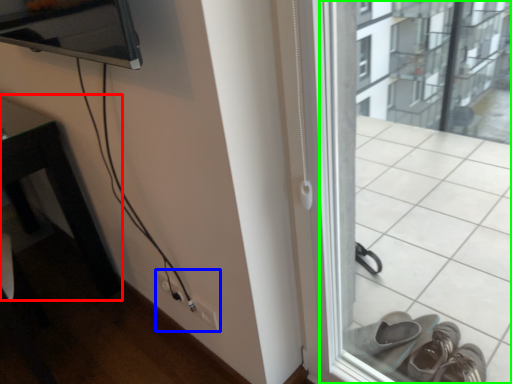
Question: Estimate the real-world distances between objects in this image. Which object is farther from table (highlighted by a red box), electric outlet (highlighted by a blue box) or window frame (highlighted by a green box)?

Choices:
 (A) electric outlet
 (B) window frame

Answer: (B)